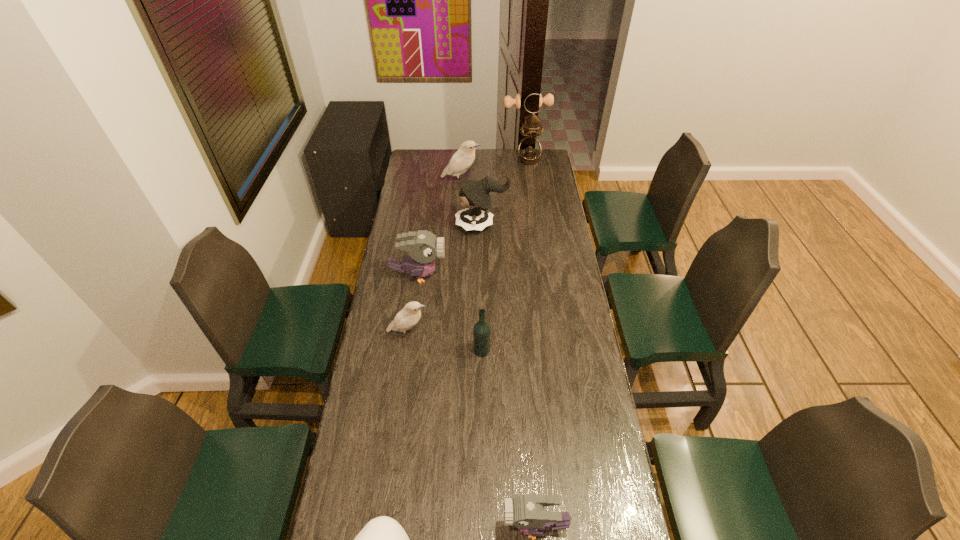
The image size is (960, 540). Find the location of `bird that is the closest one to the tallest object`. bird that is the closest one to the tallest object is located at coordinates (460, 162).

Where is `free space that satisfies the following two spatial constraints: 1. at the beak of the sixth farthest object; 2. on the right side of the seventh nearest object`? This screenshot has height=540, width=960. free space that satisfies the following two spatial constraints: 1. at the beak of the sixth farthest object; 2. on the right side of the seventh nearest object is located at coordinates (451, 350).